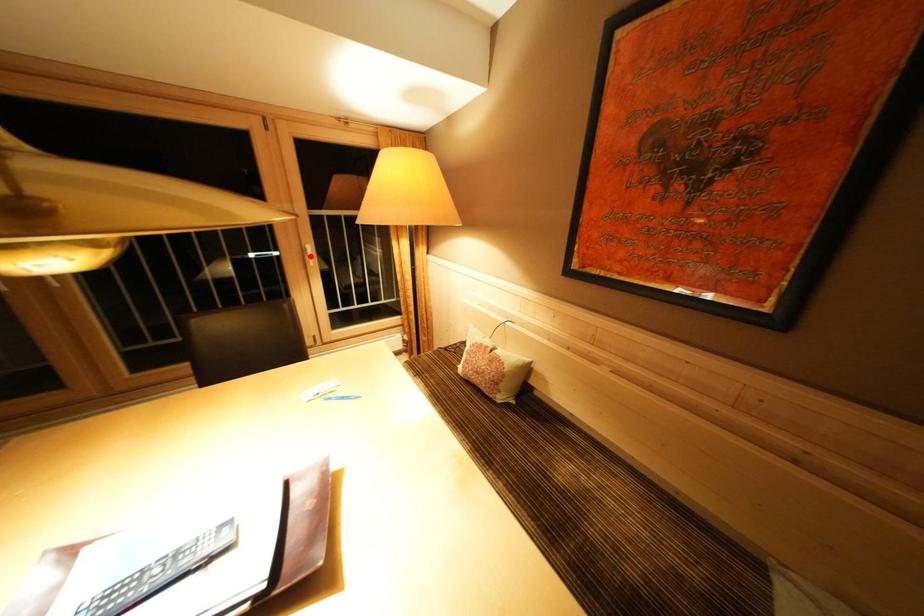
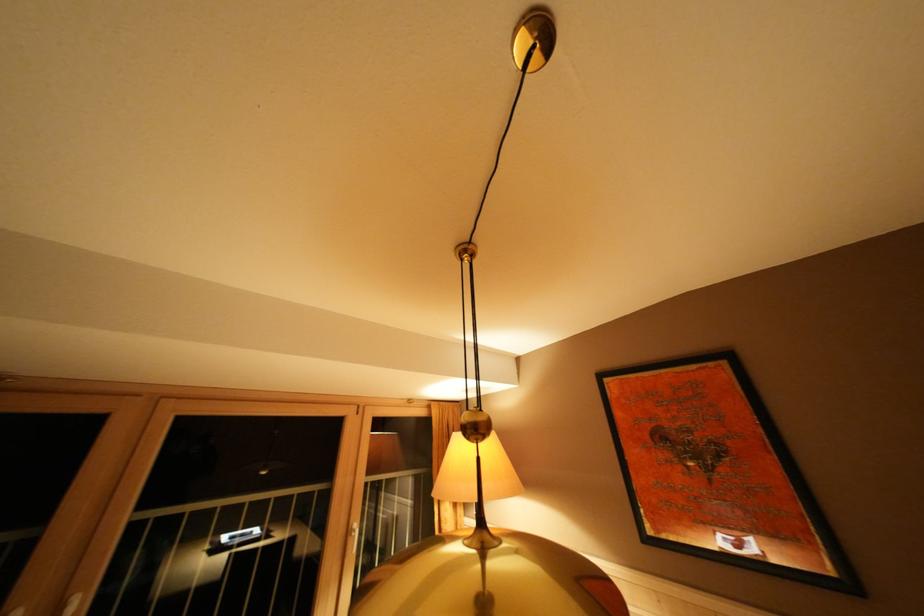
Question: I am providing you with two images of the same scene from different viewpoints. Image1 has a red point marked. In image2, the corresponding 3D location appears at what relative position? Reply with the corresponding letter.

Choices:
 (A) Closer
 (B) Farther

Answer: (B)